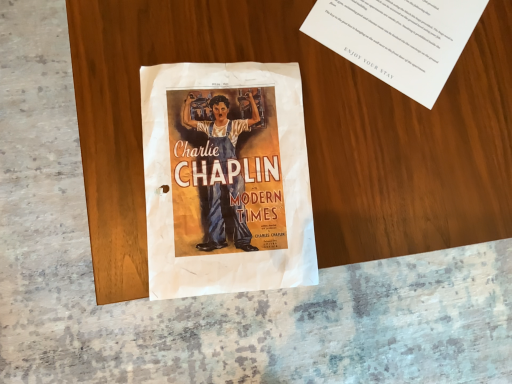
Where is `blank area beneath white paper at upper right (from a real-world perspective)`? The height and width of the screenshot is (384, 512). blank area beneath white paper at upper right (from a real-world perspective) is located at coordinates (398, 26).